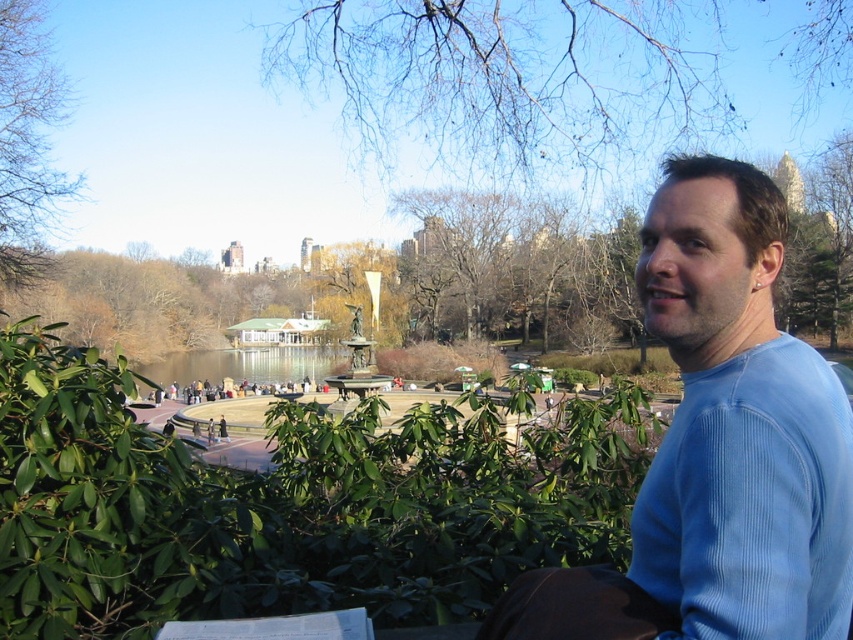
In the scene shown: You are a tailor observing a park scene. You need to determine if a piece of fabric that is 10 cm wide can fit over the blue ribbed sweater at right and the bare branches at upper center. Which object would the fabric cover more of?

The blue ribbed sweater at right is thinner than the bare branches at upper center, so the fabric would cover more of the bare branches at upper center since they are wider.

You are standing at point (49, 196) and want to walk to point (808, 99). Which direction should you go?

You should walk towards the direction of point (808, 99), which is behind point (49, 196).